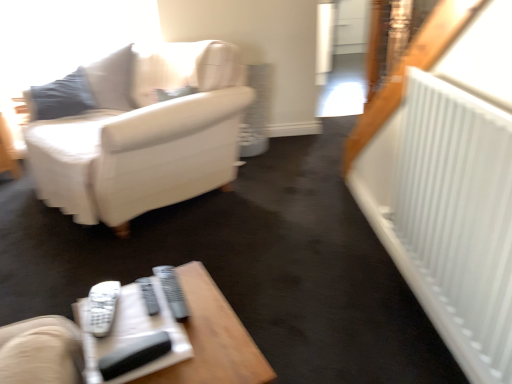
Describe the element at coordinates (213, 339) in the screenshot. The image size is (512, 384). I see `wooden table at lower center` at that location.

This screenshot has width=512, height=384. What do you see at coordinates (172, 291) in the screenshot?
I see `gray plastic remote at center, which is the second remote in left-to-right order` at bounding box center [172, 291].

How much space does gray plastic remote at center, which appears as the first remote when viewed from the right, occupy horizontally?

gray plastic remote at center, which appears as the first remote when viewed from the right, is 9.04 inches in width.

Consider the image. In order to face white leather couch at upper left, should I rotate leftwards or rightwards?

To align with it, rotate left about 16.750°.

Find the location of `white plastic remote at lower center, the first remote from the left`. white plastic remote at lower center, the first remote from the left is located at coordinates (102, 307).

Identify the location of wooden table at lower center. (x=213, y=339).

Is wooden table at lower center next to white leather couch at upper left and touching it?

No, wooden table at lower center is not with white leather couch at upper left.

Identify the location of studio couch above the wooden table at lower center (from a real-world perspective). The height and width of the screenshot is (384, 512). (143, 134).

Do you think wooden table at lower center is within white leather couch at upper left, or outside of it?

wooden table at lower center is not enclosed by white leather couch at upper left.

Looking at this image, considering the positions of objects wooden table at lower center and white leather couch at upper left in the image provided, who is more to the left, wooden table at lower center or white leather couch at upper left?

Positioned to the left is white leather couch at upper left.

From the image's perspective, which is below, white plastic remote at lower center, which is counted as the 2th remote, starting from the right, or white leather couch at upper left?

white plastic remote at lower center, which is counted as the 2th remote, starting from the right, appears lower in the image.

Is white plastic remote at lower center, the first remote from the left, aimed at white leather couch at upper left?

Yes.

Can you confirm if white plastic remote at lower center, the first remote from the left, is taller than white leather couch at upper left?

In fact, white plastic remote at lower center, the first remote from the left, may be shorter than white leather couch at upper left.

Which is in front, point (100, 325) or point (86, 224)?

The point (100, 325) is closer.

Between gray plastic remote at center, which appears as the first remote when viewed from the right, and wooden table at lower center, which one has more height?

wooden table at lower center is taller.

Is the position of gray plastic remote at center, which appears as the first remote when viewed from the right, less distant than that of wooden table at lower center?

No, gray plastic remote at center, which appears as the first remote when viewed from the right, is further to the viewer.

Is gray plastic remote at center, which appears as the first remote when viewed from the right, positioned far away from wooden table at lower center?

That's not correct — gray plastic remote at center, which appears as the first remote when viewed from the right, is a little close to wooden table at lower center.

Which is behind, wooden table at lower center or white plastic remote at lower center, the first remote from the left?

white plastic remote at lower center, the first remote from the left, is further away from the camera.

From the image's perspective, is wooden table at lower center above or below white plastic remote at lower center, the first remote from the left?

Clearly, from the image's perspective, wooden table at lower center is below white plastic remote at lower center, the first remote from the left.

Does point (36, 347) appear closer or farther from the camera than point (108, 311)?

Clearly, point (36, 347) is closer to the camera than point (108, 311).

Would you say gray plastic remote at center, which appears as the first remote when viewed from the right, is inside or outside white plastic remote at lower center, the first remote from the left?

gray plastic remote at center, which appears as the first remote when viewed from the right, is not inside white plastic remote at lower center, the first remote from the left, it's outside.

From a real-world perspective, is gray plastic remote at center, which appears as the first remote when viewed from the right, below white plastic remote at lower center, the first remote from the left?

Yes, from a real-world perspective, gray plastic remote at center, which appears as the first remote when viewed from the right, is under white plastic remote at lower center, the first remote from the left.

Considering the sizes of gray plastic remote at center, which appears as the first remote when viewed from the right, and white plastic remote at lower center, the first remote from the left, in the image, is gray plastic remote at center, which appears as the first remote when viewed from the right, bigger or smaller than white plastic remote at lower center, the first remote from the left,?

gray plastic remote at center, which appears as the first remote when viewed from the right, is smaller than white plastic remote at lower center, the first remote from the left.

From the image's perspective, is gray plastic remote at center, which is the second remote in left-to-right order, above white plastic remote at lower center, the first remote from the left?

Yes, from the image's perspective, gray plastic remote at center, which is the second remote in left-to-right order, is over white plastic remote at lower center, the first remote from the left.

Is white plastic remote at lower center, the first remote from the left, thinner than gray plastic remote at center, which is the second remote in left-to-right order?

Yes.

Considering the relative positions of white plastic remote at lower center, the first remote from the left, and gray plastic remote at center, which is the second remote in left-to-right order, in the image provided, is white plastic remote at lower center, the first remote from the left, in front of gray plastic remote at center, which is the second remote in left-to-right order,?

Yes, it is.

Consider the image. Is white plastic remote at lower center, the first remote from the left, spatially inside gray plastic remote at center, which appears as the first remote when viewed from the right, or outside of it?

white plastic remote at lower center, the first remote from the left, is outside gray plastic remote at center, which appears as the first remote when viewed from the right.

Which object is closer to the camera taking this photo, white plastic remote at lower center, which is counted as the 2th remote, starting from the right, or wooden table at lower center?

wooden table at lower center.

Between white plastic remote at lower center, the first remote from the left, and wooden table at lower center, which one appears on the right side from the viewer's perspective?

Positioned to the right is wooden table at lower center.

Looking at their sizes, would you say white plastic remote at lower center, the first remote from the left, is wider or thinner than wooden table at lower center?

Clearly, white plastic remote at lower center, the first remote from the left, has less width compared to wooden table at lower center.

Where is `studio couch that is above the wooden table at lower center (from a real-world perspective)`? The width and height of the screenshot is (512, 384). studio couch that is above the wooden table at lower center (from a real-world perspective) is located at coordinates (143, 134).

The height and width of the screenshot is (384, 512). I want to click on studio couch on the left of white plastic remote at lower center, the first remote from the left, so click(x=143, y=134).

Considering their positions, is gray plastic remote at center, which appears as the first remote when viewed from the right, positioned closer to wooden table at lower center than white leather couch at upper left?

gray plastic remote at center, which appears as the first remote when viewed from the right, lies closer to wooden table at lower center than the other object.

When comparing their distances from white plastic remote at lower center, the first remote from the left, does wooden table at lower center or gray plastic remote at center, which appears as the first remote when viewed from the right, seem closer?

gray plastic remote at center, which appears as the first remote when viewed from the right, lies closer to white plastic remote at lower center, the first remote from the left, than the other object.

In the scene shown: Based on their spatial positions, is white leather couch at upper left or gray plastic remote at center, which is the second remote in left-to-right order, further from white plastic remote at lower center, which is counted as the 2th remote, starting from the right?

white leather couch at upper left lies further to white plastic remote at lower center, which is counted as the 2th remote, starting from the right, than the other object.

Looking at the image, which one is located closer to wooden table at lower center, gray plastic remote at center, which appears as the first remote when viewed from the right, or white plastic remote at lower center, which is counted as the 2th remote, starting from the right?

The object closer to wooden table at lower center is gray plastic remote at center, which appears as the first remote when viewed from the right.

Based on their spatial positions, is white plastic remote at lower center, the first remote from the left, or wooden table at lower center further from gray plastic remote at center, which is the second remote in left-to-right order?

wooden table at lower center lies further to gray plastic remote at center, which is the second remote in left-to-right order, than the other object.

Which object lies further to the anchor point wooden table at lower center, white plastic remote at lower center, the first remote from the left, or white leather couch at upper left?

Among the two, white leather couch at upper left is located further to wooden table at lower center.

Estimate the real-world distances between objects in this image. Which object is further from white plastic remote at lower center, which is counted as the 2th remote, starting from the right, white leather couch at upper left or wooden table at lower center?

white leather couch at upper left lies further to white plastic remote at lower center, which is counted as the 2th remote, starting from the right, than the other object.

From the image, which object appears to be farther from white leather couch at upper left, wooden table at lower center or gray plastic remote at center, which appears as the first remote when viewed from the right?

Among the two, gray plastic remote at center, which appears as the first remote when viewed from the right, is located further to white leather couch at upper left.

Locate an element on the screen. Image resolution: width=512 pixels, height=384 pixels. remote between gray plastic remote at center, which appears as the first remote when viewed from the right, and wooden table at lower center vertically is located at coordinates (102, 307).

Locate an element on the screen. This screenshot has width=512, height=384. remote between white leather couch at upper left and white plastic remote at lower center, which is counted as the 2th remote, starting from the right, vertically is located at coordinates (172, 291).